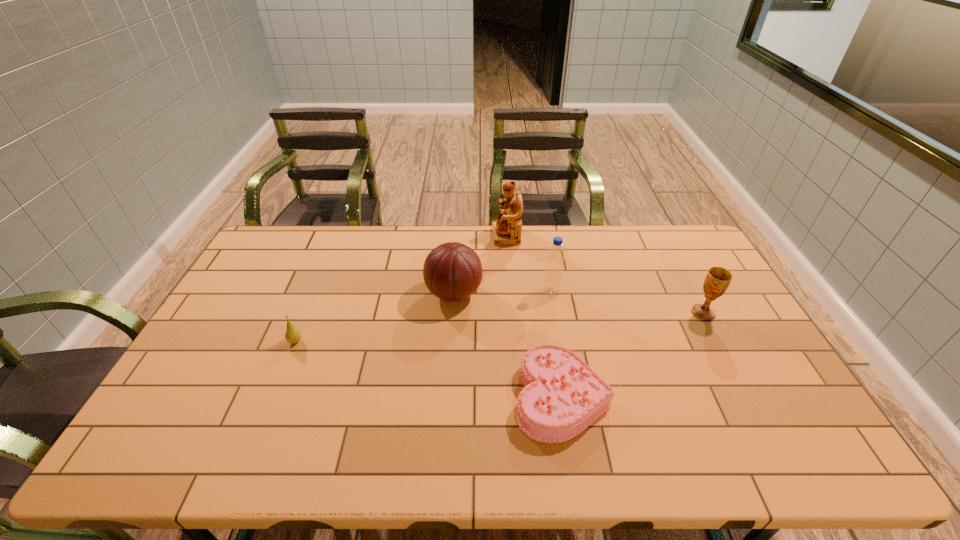
Locate an element on the screen. figurine is located at coordinates (507, 230).

Find the location of `water bottle`. water bottle is located at coordinates pyautogui.click(x=555, y=257).

Where is `the second object from left to right`? the second object from left to right is located at coordinates (453, 271).

The height and width of the screenshot is (540, 960). Find the location of `the rightmost object`. the rightmost object is located at coordinates [x=718, y=279].

You are a GUI agent. You are given a task and a screenshot of the screen. Output one action in this format:
    pyautogui.click(x=<x>, y=<y>)
    Task: Click on the chalice
    The height and width of the screenshot is (540, 960).
    Given the screenshot: What is the action you would take?
    pyautogui.click(x=718, y=279)

I want to click on the fifth tallest object, so tap(293, 335).

The image size is (960, 540). Find the location of `the second nearest object`. the second nearest object is located at coordinates (293, 335).

You are a GUI agent. You are given a task and a screenshot of the screen. Output one action in this format:
    pyautogui.click(x=<x>, y=<y>)
    Task: Click on the nearest object
    This screenshot has width=960, height=540.
    Given the screenshot: What is the action you would take?
    pyautogui.click(x=562, y=395)

The height and width of the screenshot is (540, 960). Identify the location of the shortest object. (562, 395).

Where is `free point located 0.270m on the front-facing side of the figurine`? Image resolution: width=960 pixels, height=540 pixels. free point located 0.270m on the front-facing side of the figurine is located at coordinates (422, 236).